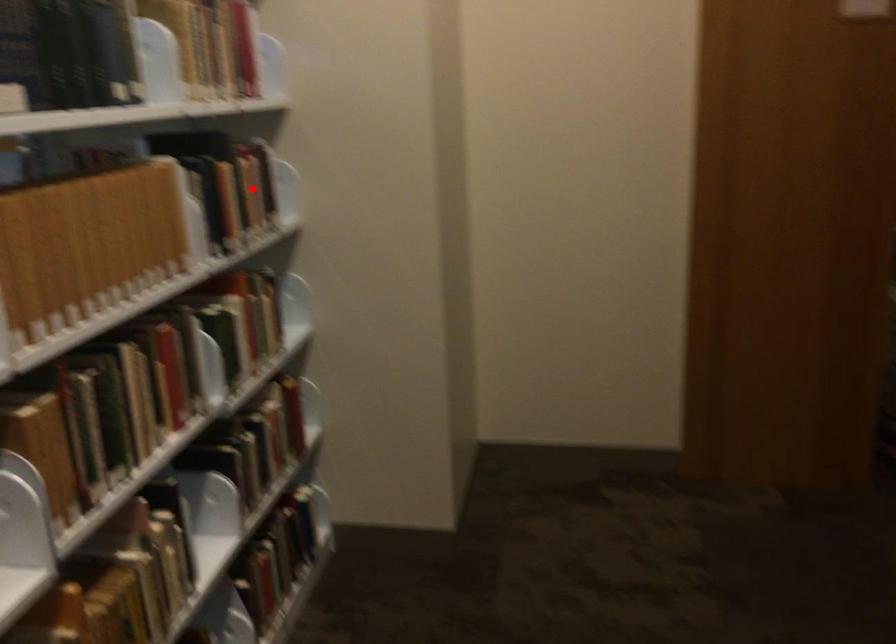
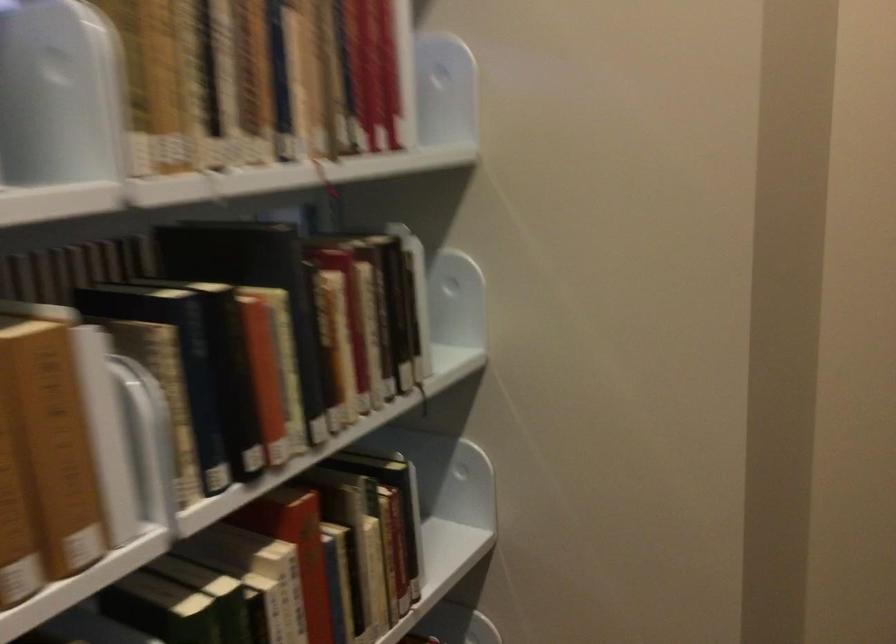
Question: A red point is marked in image1. In image2, is the corresponding 3D point closer to the camera or farther? Reply with the corresponding letter.

Choices:
 (A) The corresponding 3D point is closer.
 (B) The corresponding 3D point is farther.

Answer: (A)